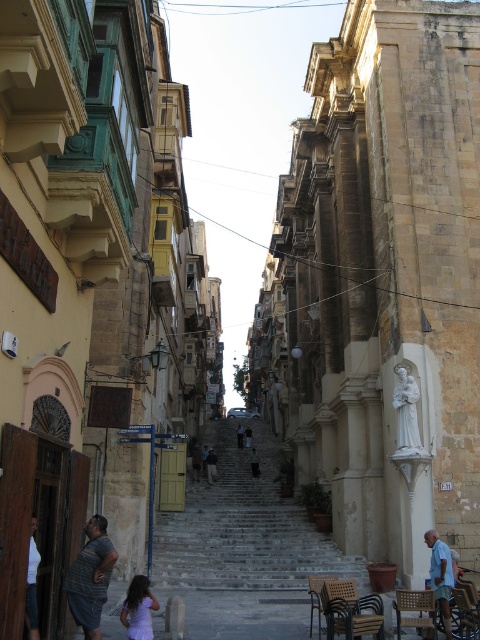
Does gray fabric shirt at lower left appear under light blue fabric shirt at lower right?

No, gray fabric shirt at lower left is not below light blue fabric shirt at lower right.

Locate an element on the screen. gray fabric shirt at lower left is located at coordinates (91, 577).

Does point (85, 596) come farther from viewer compared to point (430, 541)?

No, (85, 596) is in front of (430, 541).

Identify the location of gray fabric shirt at lower left. (91, 577).

Describe the element at coordinates (243, 528) in the screenshot. The height and width of the screenshot is (640, 480). I see `stone steps at center` at that location.

Is stone steps at center positioned behind white cotton shirt at lower left?

Yes, it is behind white cotton shirt at lower left.

Find the location of a particular element. The width and height of the screenshot is (480, 640). stone steps at center is located at coordinates (243, 528).

Is purple satin dress at center positioned at the back of white cotton shirt at lower left?

Yes.

What do you see at coordinates (139, 609) in the screenshot? I see `purple satin dress at center` at bounding box center [139, 609].

The width and height of the screenshot is (480, 640). What do you see at coordinates (139, 609) in the screenshot?
I see `purple satin dress at center` at bounding box center [139, 609].

At what (x,y) coordinates should I click in order to perform the action: click on purple satin dress at center. Please return your answer as a coordinate pair (x, y). Looking at the image, I should click on (139, 609).